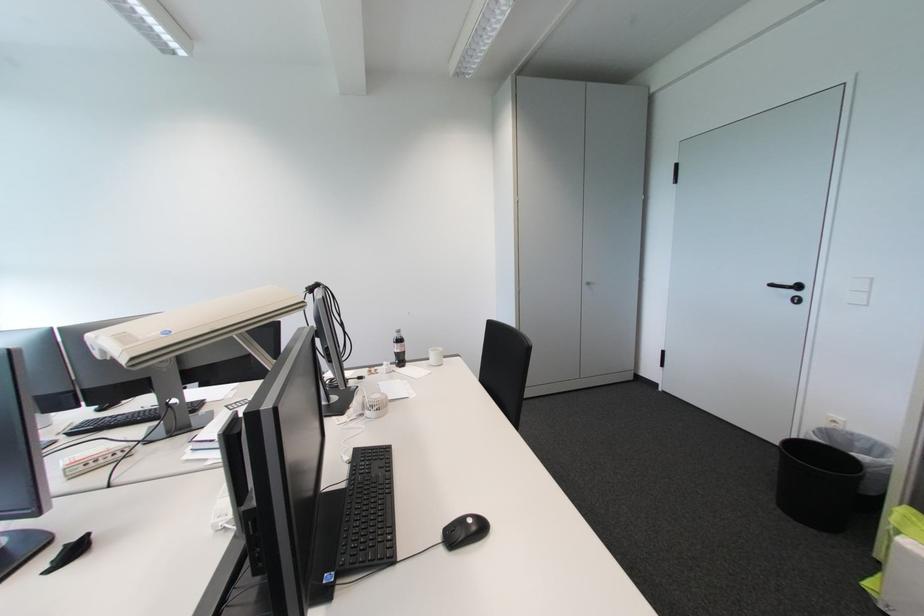
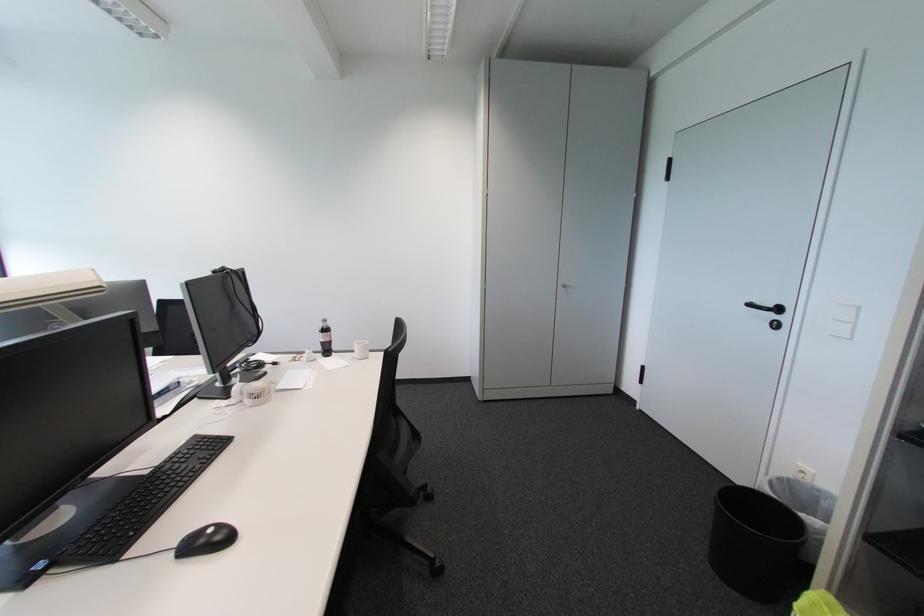
The point at (x=797, y=294) is marked in the first image. Where is the corresponding point in the second image?

(777, 317)